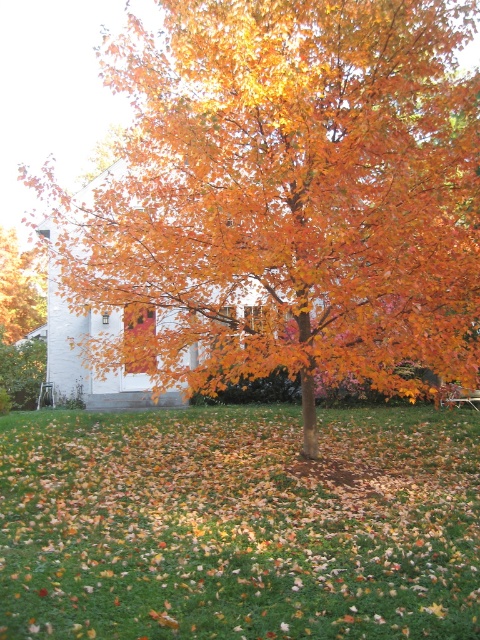
You are standing in front of the golden glossy tree at center and want to take a photo that includes both the tree and the white house in the background. Given that the camera can focus on objects up to 10 meters away, will the white house be in focus if you focus on the tree?

The golden glossy tree at center is 6.72 meters away from the camera. Since the camera can focus up to 10 meters, the white house, being further back than the tree, would still be within the focus range as long as it is within 10 meters from the camera. However, the exact distance of the house isn not provided, so we can only confirm the tree is within range, but cannot confirm the house without knowing its distance.

You are standing in the autumn scene and want to take a photo of both the golden glossy tree at center and the green grass at center. Which object should you focus on first if you want to capture both in the same frame without moving the camera?

Since the golden glossy tree at center is smaller in size compared to the green grass at center, you should focus on the golden glossy tree at center first to ensure it is properly framed within the camera view.